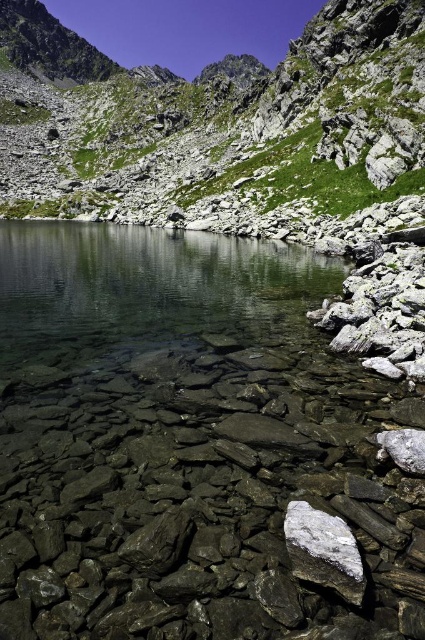
You are standing at the edge of the mountain lake and want to climb the highest object in the scene. Which one should you choose between the green grassy hillside at upper center and the white crystalline rock at center?

The green grassy hillside at upper center is much taller than the white crystalline rock at center, so you should choose the green grassy hillside at upper center to climb as it is the highest object in the scene.

Consider the image. You are standing on the rocky shoreline of the mountain lake and want to walk towards the green grassy hillside at upper center. Which direction should you head to avoid stepping into the clear stone water at center?

You should head to the left side of the green grassy hillside at upper center to avoid stepping into the clear stone water at center, as the clear stone water at center is positioned on the right side of the green grassy hillside at upper center.